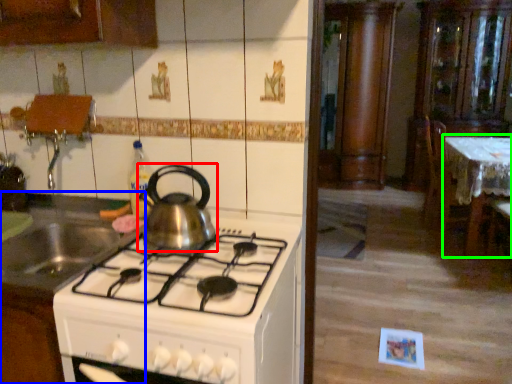
Question: Which is farther away from kitchen appliance (highlighted by a red box)? kitchen appliance (highlighted by a blue box) or table (highlighted by a green box)?

Choices:
 (A) kitchen appliance
 (B) table

Answer: (B)